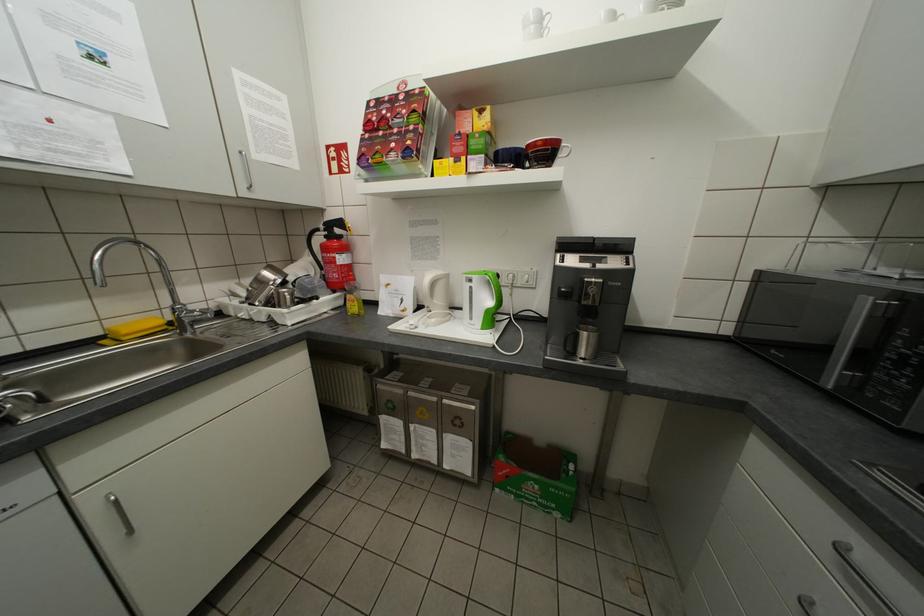
Describe the element at coordinates (432, 288) in the screenshot. This screenshot has height=616, width=924. I see `a white kettle handle` at that location.